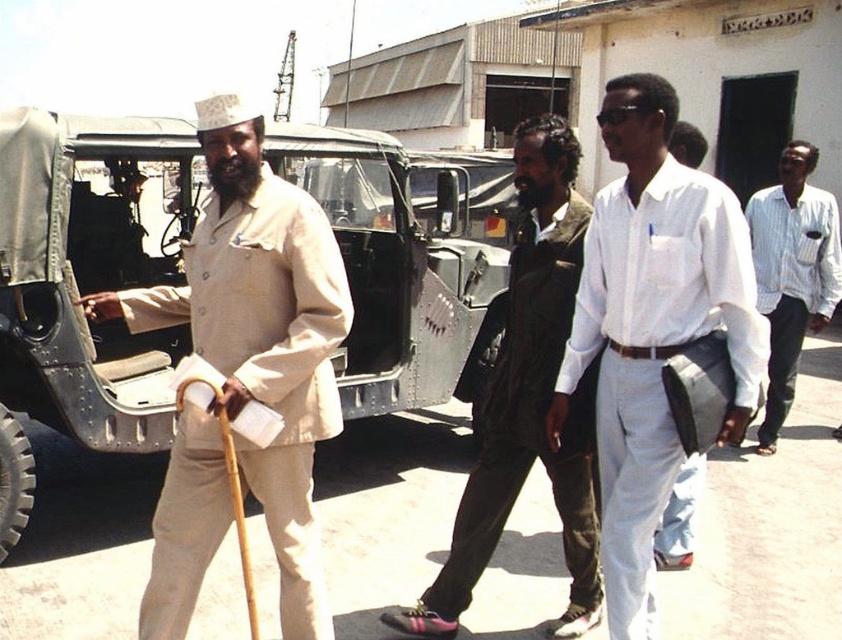
Does beige fabric coat at left appear under white striped shirt at right?

Yes.

Can you confirm if beige fabric coat at left is smaller than white striped shirt at right?

Incorrect, beige fabric coat at left is not smaller in size than white striped shirt at right.

Between point (296, 452) and point (753, 211), which one is positioned in front?

Point (296, 452)

Find the location of a particular element. The image size is (842, 640). beige fabric coat at left is located at coordinates (244, 372).

From the picture: Can you confirm if beige fabric coat at left is wider than white smooth shirt at center?

Yes, beige fabric coat at left is wider than white smooth shirt at center.

Can you confirm if beige fabric coat at left is bigger than white smooth shirt at center?

Correct, beige fabric coat at left is larger in size than white smooth shirt at center.

Is point (237, 371) positioned after point (674, 193)?

No.

Find the location of `beige fabric coat at left`. beige fabric coat at left is located at coordinates (244, 372).

Is white smooth shirt at center closer to camera compared to white striped shirt at right?

Yes, it is.

Is white smooth shirt at center thinner than white striped shirt at right?

Indeed, white smooth shirt at center has a lesser width compared to white striped shirt at right.

What do you see at coordinates (653, 330) in the screenshot?
I see `white smooth shirt at center` at bounding box center [653, 330].

Identify the location of white smooth shirt at center. Image resolution: width=842 pixels, height=640 pixels. (653, 330).